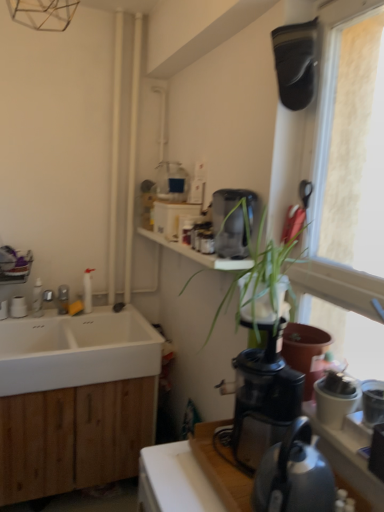
The image size is (384, 512). Describe the element at coordinates (73, 437) in the screenshot. I see `wooden cabinet at lower left` at that location.

What do you see at coordinates (63, 298) in the screenshot?
I see `brushed metal faucet at left` at bounding box center [63, 298].

What do you see at coordinates (233, 221) in the screenshot? I see `satin black coffee maker at upper center, which is counted as the 1th coffee maker, starting from the top` at bounding box center [233, 221].

Identify the location of green leafy plant at upper right. The height and width of the screenshot is (512, 384). (258, 270).

The image size is (384, 512). What do you see at coordinates (351, 149) in the screenshot? I see `transparent plastic window at upper right` at bounding box center [351, 149].

In order to face wooden countertop at lower right, should I rotate leftwards or rightwards?

You should look right and rotate roughly 10.094 degrees.

Find the location of a particular element. wooden countertop at lower right is located at coordinates (220, 469).

What do you see at coordinates (262, 398) in the screenshot? I see `black plastic coffee maker at center-right, which is counted as the 1th coffee maker, starting from the bottom` at bounding box center [262, 398].

What do you see at coordinates (76, 350) in the screenshot? Image resolution: width=384 pixels, height=512 pixels. I see `white matte sink at lower left` at bounding box center [76, 350].

The height and width of the screenshot is (512, 384). I want to click on wooden cabinet at lower left, so click(73, 437).

Considering the relative sizes of satin black coffee maker at upper center, which is counted as the 1th coffee maker, starting from the top, and black plastic coffee maker at center-right, positioned as the 1th coffee maker in front-to-back order, in the image provided, is satin black coffee maker at upper center, which is counted as the 1th coffee maker, starting from the top, thinner than black plastic coffee maker at center-right, positioned as the 1th coffee maker in front-to-back order,?

Correct, the width of satin black coffee maker at upper center, which is counted as the 1th coffee maker, starting from the top, is less than that of black plastic coffee maker at center-right, positioned as the 1th coffee maker in front-to-back order.

Between point (254, 205) and point (235, 451), which one is positioned in front?

Point (235, 451)

Based on their sizes in the image, would you say satin black coffee maker at upper center, which is counted as the 1th coffee maker, starting from the top, is bigger or smaller than black plastic coffee maker at center-right, positioned as the 1th coffee maker in front-to-back order?

Answer: satin black coffee maker at upper center, which is counted as the 1th coffee maker, starting from the top, is smaller than black plastic coffee maker at center-right, positioned as the 1th coffee maker in front-to-back order.

Is satin black coffee maker at upper center, which is counted as the 1th coffee maker, starting from the top, further to the viewer compared to black plastic coffee maker at center-right, which is counted as the 1th coffee maker, starting from the bottom?

Yes, it is.

Is black plastic coffee maker at center-right, positioned as the 1th coffee maker in front-to-back order, touching green leafy plant at upper right?

They are not placed beside each other.

From a real-world perspective, which is physically below, black plastic coffee maker at center-right, positioned as the 1th coffee maker in front-to-back order, or green leafy plant at upper right?

black plastic coffee maker at center-right, positioned as the 1th coffee maker in front-to-back order, from a real-world perspective.

From the picture: Is black plastic coffee maker at center-right, which is the 2th coffee maker in back-to-front order, positioned beyond the bounds of green leafy plant at upper right?

black plastic coffee maker at center-right, which is the 2th coffee maker in back-to-front order, is positioned outside green leafy plant at upper right.

Considering the positions of point (237, 433) and point (269, 278), is point (237, 433) closer or farther from the camera than point (269, 278)?

Clearly, point (237, 433) is more distant from the camera than point (269, 278).

Locate an element on the screen. tap lying behind the wooden countertop at lower right is located at coordinates (63, 298).

Which object is further away from the camera taking this photo, brushed metal faucet at left or wooden countertop at lower right?

Positioned behind is brushed metal faucet at left.

Who is taller, brushed metal faucet at left or wooden countertop at lower right?

Standing taller between the two is brushed metal faucet at left.

From the picture: How distant is wooden countertop at lower right from wooden cabinet at lower left?

A distance of 35.33 inches exists between wooden countertop at lower right and wooden cabinet at lower left.

Is wooden countertop at lower right closer to camera compared to wooden cabinet at lower left?

Yes, it is.

Can you confirm if wooden countertop at lower right is wider than wooden cabinet at lower left?

No, wooden countertop at lower right is not wider than wooden cabinet at lower left.

Could you tell me if wooden countertop at lower right is turned towards wooden cabinet at lower left?

No, wooden countertop at lower right is not oriented towards wooden cabinet at lower left.

Do you think transparent plastic window at upper right is within wooden cabinet at lower left, or outside of it?

transparent plastic window at upper right is outside wooden cabinet at lower left.

From a real-world perspective, relative to wooden cabinet at lower left, is transparent plastic window at upper right vertically above or below?

From a real-world perspective, transparent plastic window at upper right is physically above wooden cabinet at lower left.

Based on their sizes in the image, would you say wooden countertop at lower right is bigger or smaller than transparent plastic window at upper right?

Clearly, wooden countertop at lower right is smaller in size than transparent plastic window at upper right.

Is wooden countertop at lower right taller or shorter than transparent plastic window at upper right?

Considering their sizes, wooden countertop at lower right has less height than transparent plastic window at upper right.

Measure the distance from wooden countertop at lower right to transparent plastic window at upper right.

The distance of wooden countertop at lower right from transparent plastic window at upper right is 28.95 inches.

Is wooden countertop at lower right inside the boundaries of transparent plastic window at upper right, or outside?

wooden countertop at lower right is not inside transparent plastic window at upper right, it's outside.

Considering their positions, is satin black coffee maker at upper center, placed as the second coffee maker when sorted from front to back, located in front of or behind metallic gray kettle at lower right?

Clearly, satin black coffee maker at upper center, placed as the second coffee maker when sorted from front to back, is behind metallic gray kettle at lower right.

Is satin black coffee maker at upper center, which is counted as the first coffee maker, starting from the back, facing towards metallic gray kettle at lower right?

No.

Image resolution: width=384 pixels, height=512 pixels. Identify the location of the 2nd coffee maker above when counting from the metallic gray kettle at lower right (from the image's perspective). (233, 221).

Is point (216, 246) closer or farther from the camera than point (312, 490)?

Point (216, 246) appears to be farther away from the viewer than point (312, 490).

Where is `coffee maker on the left of black plastic coffee maker at center-right, which is counted as the 1th coffee maker, starting from the bottom`? This screenshot has width=384, height=512. coffee maker on the left of black plastic coffee maker at center-right, which is counted as the 1th coffee maker, starting from the bottom is located at coordinates (233, 221).

At what (x,y) coordinates should I click in order to perform the action: click on houseplant located above the black plastic coffee maker at center-right, which is the 2th coffee maker in back-to-front order (from the image's perspective). Please return your answer as a coordinate pair (x, y). This screenshot has width=384, height=512. Looking at the image, I should click on (258, 270).

From the image, which object appears to be nearer to satin black coffee maker at upper center, which is counted as the 1th coffee maker, starting from the top, green leafy plant at upper right or transparent plastic window at upper right?

Based on the image, green leafy plant at upper right appears to be nearer to satin black coffee maker at upper center, which is counted as the 1th coffee maker, starting from the top.

In the scene shown: Estimate the real-world distances between objects in this image. Which object is closer to wooden countertop at lower right, satin black coffee maker at upper center, acting as the 2th coffee maker starting from the bottom, or green leafy plant at upper right?

green leafy plant at upper right is closer to wooden countertop at lower right.

Based on their spatial positions, is metallic gray kettle at lower right or brushed metal faucet at left closer to white matte sink at lower left?

brushed metal faucet at left.

Looking at this image, based on their spatial positions, is wooden countertop at lower right or black plastic coffee maker at center-right, which is counted as the 1th coffee maker, starting from the bottom, further from metallic gray kettle at lower right?

Among the two, wooden countertop at lower right is located further to metallic gray kettle at lower right.

Considering their positions, is brushed metal faucet at left positioned closer to satin black coffee maker at upper center, acting as the 2th coffee maker starting from the bottom, than wooden countertop at lower right?

wooden countertop at lower right is closer to satin black coffee maker at upper center, acting as the 2th coffee maker starting from the bottom.

Which object lies nearer to the anchor point wooden countertop at lower right, white matte sink at lower left or metallic gray kettle at lower right?

Among the two, metallic gray kettle at lower right is located nearer to wooden countertop at lower right.

Looking at the image, which one is located closer to green leafy plant at upper right, metallic gray kettle at lower right or transparent plastic window at upper right?

transparent plastic window at upper right is positioned closer to the anchor green leafy plant at upper right.

Looking at this image, which object lies nearer to the anchor point black plastic coffee maker at center-right, which is counted as the 1th coffee maker, starting from the bottom, wooden cabinet at lower left or green leafy plant at upper right?

green leafy plant at upper right lies closer to black plastic coffee maker at center-right, which is counted as the 1th coffee maker, starting from the bottom, than the other object.

I want to click on sink between brushed metal faucet at left and wooden cabinet at lower left vertically, so click(x=76, y=350).

Where is `houseplant between wooden countertop at lower right and white matte sink at lower left from front to back`? This screenshot has width=384, height=512. houseplant between wooden countertop at lower right and white matte sink at lower left from front to back is located at coordinates (258, 270).

Identify the location of houseplant between metallic gray kettle at lower right and white matte sink at lower left from front to back. (258, 270).

At what (x,y) coordinates should I click in order to perform the action: click on cabinetry between wooden countertop at lower right and brushed metal faucet at left from front to back. Please return your answer as a coordinate pair (x, y). The height and width of the screenshot is (512, 384). Looking at the image, I should click on (73, 437).